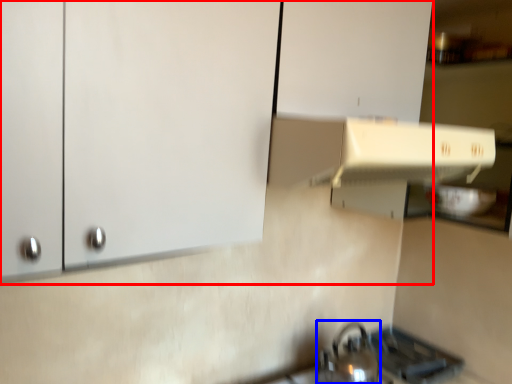
Question: Which object is closer to the camera taking this photo, cabinetry (highlighted by a red box) or tea pot (highlighted by a blue box)?

Choices:
 (A) cabinetry
 (B) tea pot

Answer: (A)